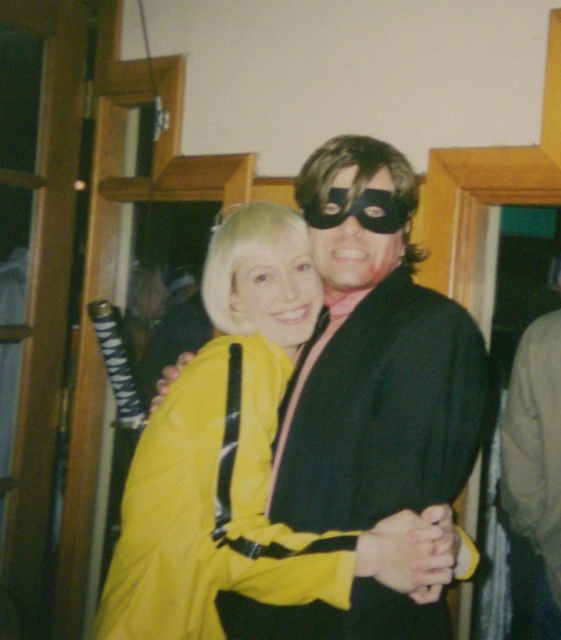
Question: Can you confirm if yellow shiny jacket at center is wider than brown suede jacket at right?

Choices:
 (A) yes
 (B) no

Answer: (A)

Question: Which point is farther to the camera?

Choices:
 (A) (333, 252)
 (B) (302, 589)

Answer: (A)

Question: Which object is farther from the camera taking this photo?

Choices:
 (A) brown suede jacket at right
 (B) black matte robe at center
 (C) black matte mask at center
 (D) yellow matte jacket at center

Answer: (A)

Question: Is yellow shiny jacket at center thinner than brown suede jacket at right?

Choices:
 (A) yes
 (B) no

Answer: (B)

Question: Is black matte robe at center to the left of yellow matte jacket at center from the viewer's perspective?

Choices:
 (A) yes
 (B) no

Answer: (B)

Question: Which object is positioned farthest from the black matte robe at center?

Choices:
 (A) black matte mask at center
 (B) yellow shiny jacket at center
 (C) brown suede jacket at right

Answer: (C)